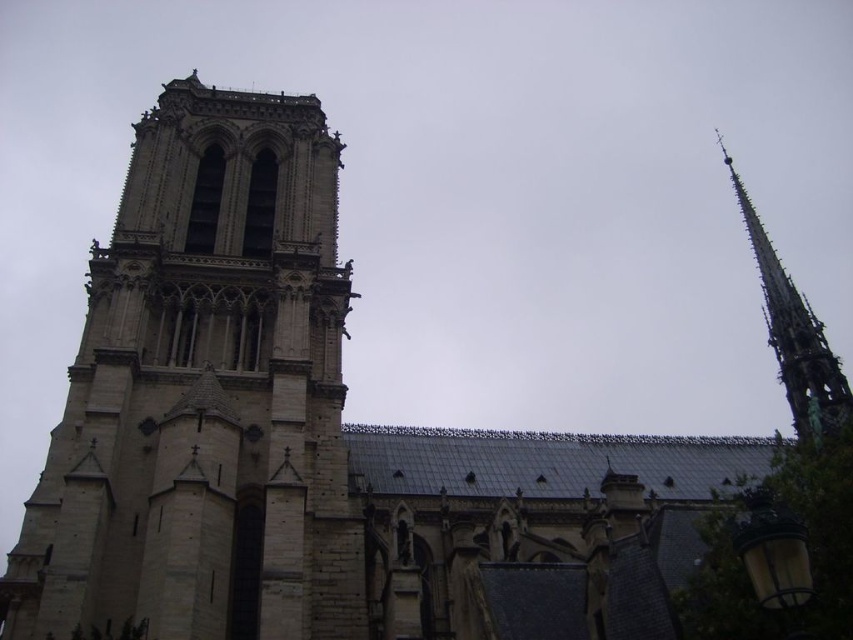
Question: Does stone tower at left lie in front of green copper spire at upper right?

Choices:
 (A) no
 (B) yes

Answer: (B)

Question: Where is stone tower at left located in relation to green copper spire at upper right in the image?

Choices:
 (A) left
 (B) right

Answer: (A)

Question: Is stone tower at left further to the viewer compared to green copper spire at upper right?

Choices:
 (A) no
 (B) yes

Answer: (A)